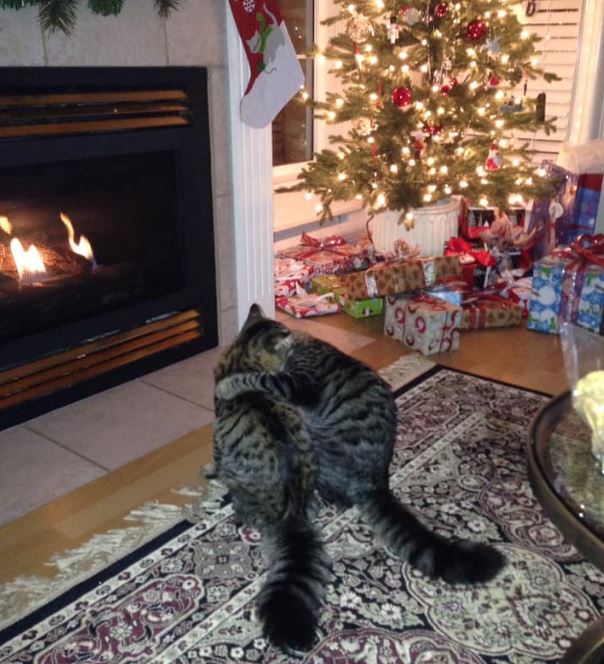
Where is `rug`? Image resolution: width=604 pixels, height=664 pixels. rug is located at coordinates (180, 604).